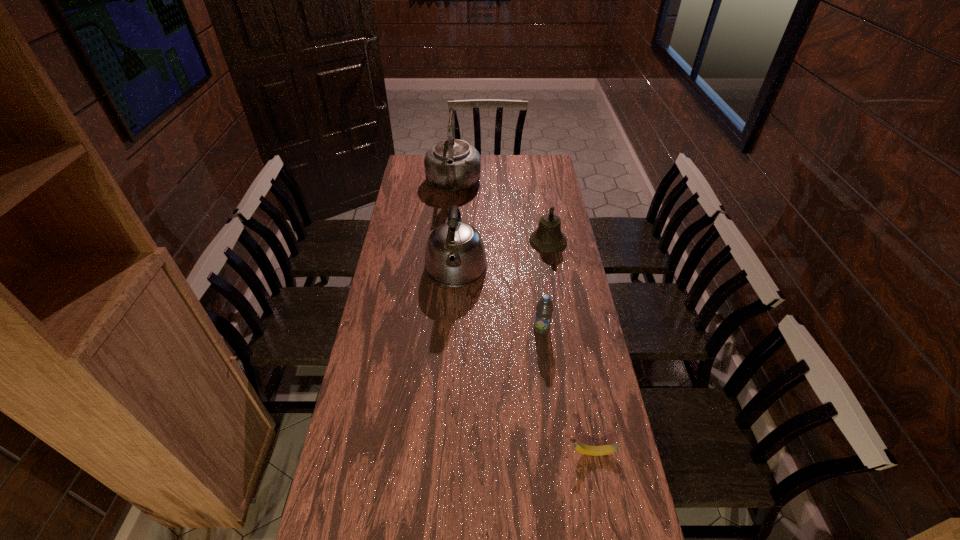
Locate an element on the screen. The width and height of the screenshot is (960, 540). the farthest object is located at coordinates (451, 165).

This screenshot has height=540, width=960. Identify the location of the tallest object. (451, 165).

Identify the location of the nearer kettle. Image resolution: width=960 pixels, height=540 pixels. (455, 256).

Locate an element on the screen. The height and width of the screenshot is (540, 960). the shorter kettle is located at coordinates (455, 256).

Find the location of a particular element. Image resolution: width=960 pixels, height=540 pixels. bell is located at coordinates (548, 238).

Where is `water bottle`? Image resolution: width=960 pixels, height=540 pixels. water bottle is located at coordinates (544, 308).

Where is `the shortest object`? The width and height of the screenshot is (960, 540). the shortest object is located at coordinates (579, 447).

This screenshot has height=540, width=960. Identify the location of banana. (579, 447).

At what (x,y) coordinates should I click in order to perform the action: click on vacant space located 0.210m at the spout of the farther kettle. Please return your answer as a coordinate pair (x, y). The width and height of the screenshot is (960, 540). Looking at the image, I should click on (449, 232).

At what (x,y) coordinates should I click in order to perform the action: click on vacant point located on the spout of the fourth shortest object. Please return your answer as a coordinate pair (x, y). The image size is (960, 540). Looking at the image, I should click on [453, 313].